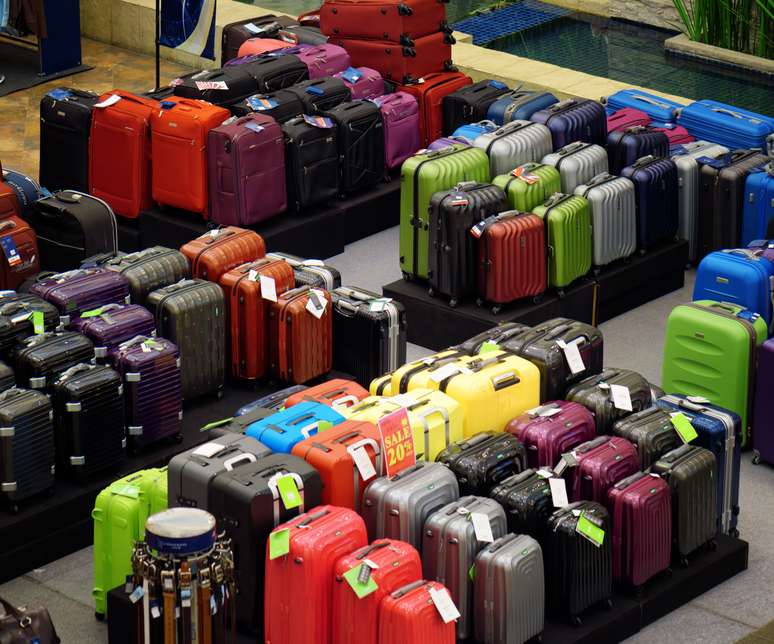
At what (x,y) coordinates should I click in order to perform the action: click on floor. Please return your answer as a coordinate pair (x, y). The width and height of the screenshot is (774, 644). Looking at the image, I should click on (723, 620).